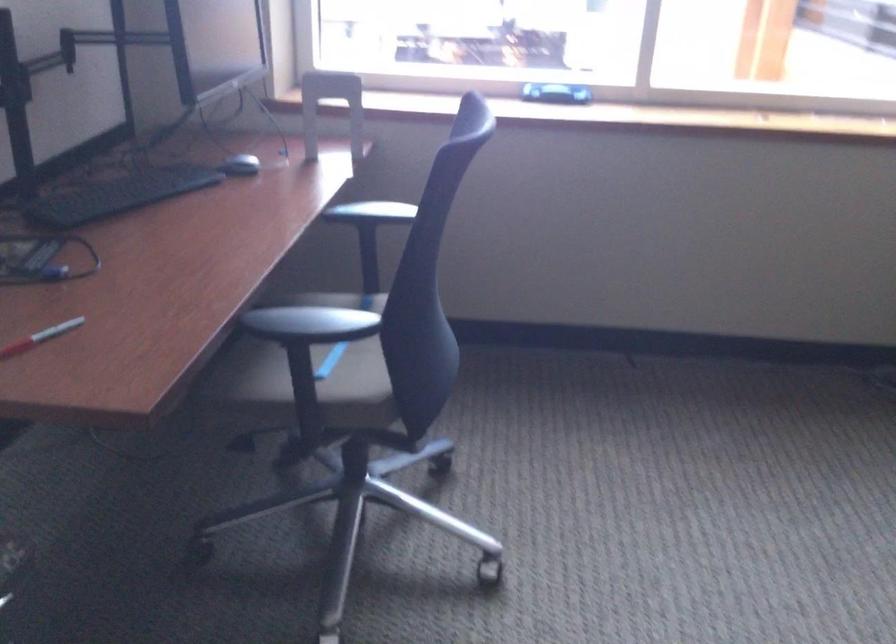
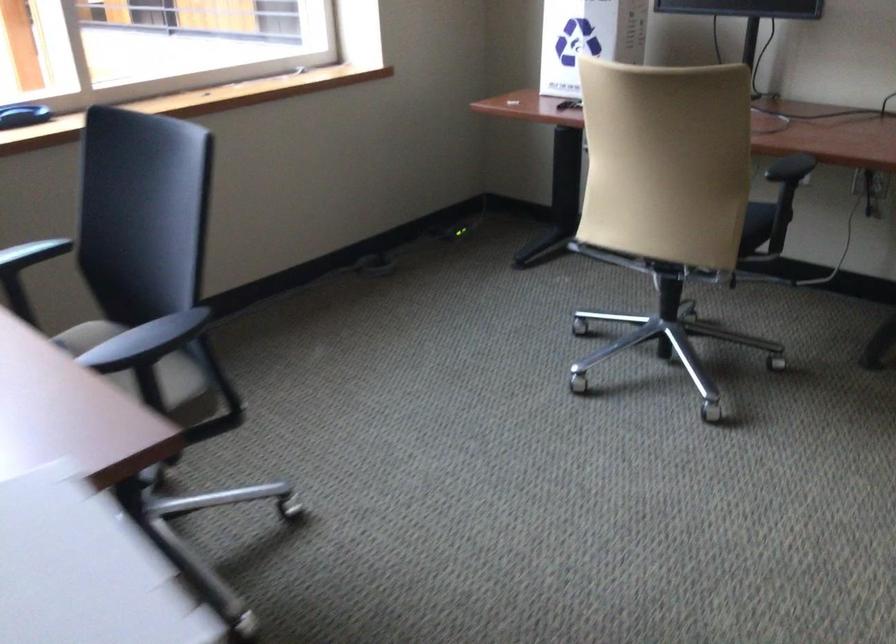
In the second image, find the point that corresponds to (x=382, y=212) in the first image.

(31, 254)